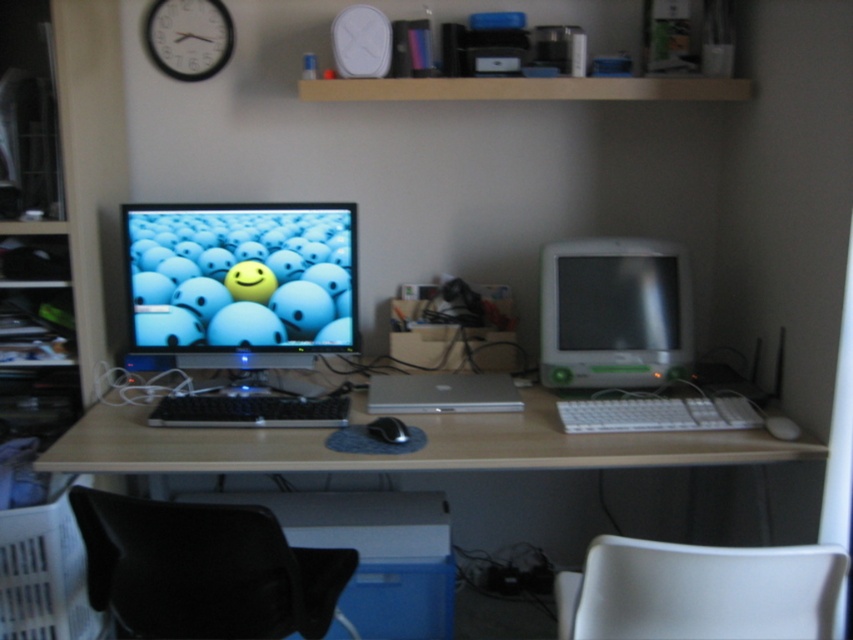
Question: Is white plastic keyboard at center above black plastic keyboard at center?

Choices:
 (A) no
 (B) yes

Answer: (A)

Question: Which object appears closest to the camera in this image?

Choices:
 (A) matte plastic monitor at center
 (B) black leather swivel chair at lower left

Answer: (B)

Question: Among these objects, which one is farthest from the camera?

Choices:
 (A) matte plastic monitor at center
 (B) black leather swivel chair at lower left
 (C) black plastic clock at upper left

Answer: (C)

Question: Which of the following is the farthest from the observer?

Choices:
 (A) matte plastic monitor at center
 (B) black plastic keyboard at center
 (C) silver metallic laptop at center
 (D) white plastic keyboard at center

Answer: (A)

Question: Does black leather swivel chair at lower left appear under white plastic monitor at right?

Choices:
 (A) no
 (B) yes

Answer: (B)

Question: Is white plastic keyboard at center above black plastic keyboard at center?

Choices:
 (A) no
 (B) yes

Answer: (A)